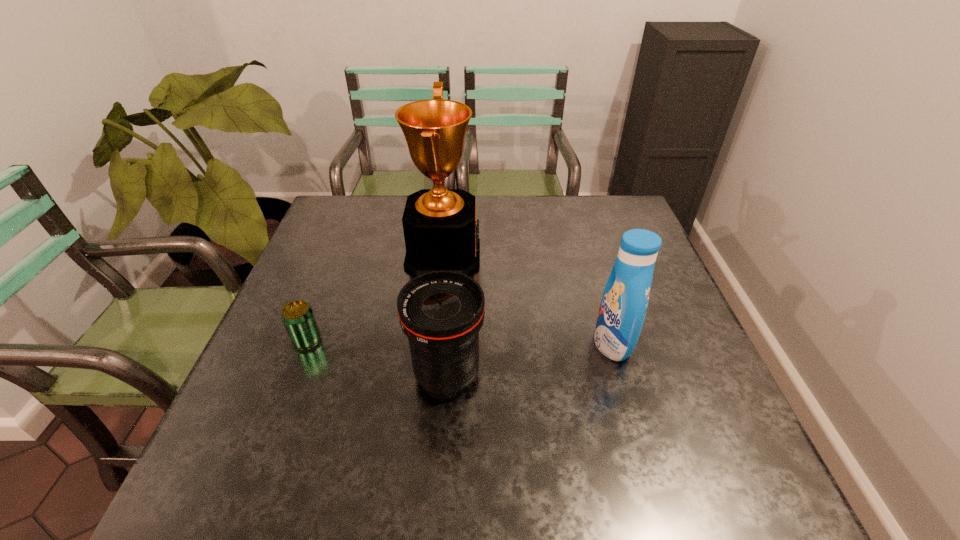
At what (x,y) coordinates should I click in order to perform the action: click on the tallest object. Please return your answer as a coordinate pair (x, y). Looking at the image, I should click on (439, 224).

Locate an element on the screen. This screenshot has height=540, width=960. trophy cup is located at coordinates (439, 224).

Find the location of `the third shortest object`. the third shortest object is located at coordinates (623, 307).

You are a GUI agent. You are given a task and a screenshot of the screen. Output one action in this format:
    pyautogui.click(x=<x>, y=<y>)
    Task: Click on the detergent
    
    Given the screenshot: What is the action you would take?
    pyautogui.click(x=623, y=307)

Locate an element on the screen. telephoto lens is located at coordinates (441, 312).

You are a GUI agent. You are given a task and a screenshot of the screen. Output one action in this format:
    pyautogui.click(x=<x>, y=<y>)
    Task: Click on the leftmost object
    The height and width of the screenshot is (540, 960).
    Given the screenshot: What is the action you would take?
    pyautogui.click(x=298, y=318)

The height and width of the screenshot is (540, 960). I want to click on the shortest object, so click(x=298, y=318).

Identify the location of vacant region located 0.350m on the front of the farthest object with the label. This screenshot has width=960, height=540. (602, 255).

You are a GUI agent. You are given a task and a screenshot of the screen. Output one action in this format:
    pyautogui.click(x=<x>, y=<y>)
    Task: Click on the vacant space positioned on the front-facing side of the third shortest object
    The height and width of the screenshot is (540, 960).
    Given the screenshot: What is the action you would take?
    539,342

Identify the location of vacant space located on the front-facing side of the third shortest object. This screenshot has height=540, width=960. (430, 342).